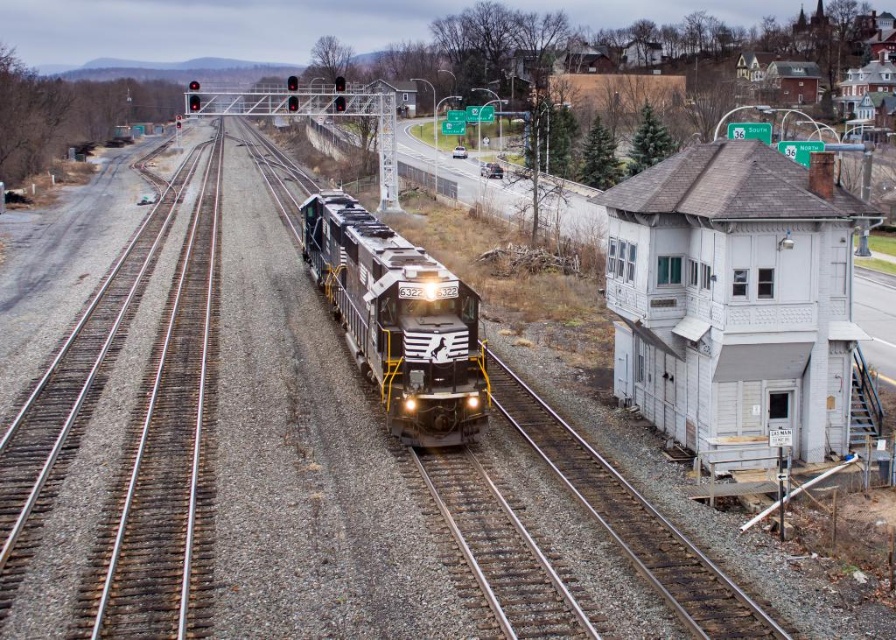
Question: Which point is farther to the camera?

Choices:
 (A) (506, 3)
 (B) (358, 285)

Answer: (A)

Question: Is black textured locomotive at center to the right of brick building at upper right from the viewer's perspective?

Choices:
 (A) yes
 (B) no

Answer: (B)

Question: Where is smooth steel tracks at center located in relation to brick building at upper right in the image?

Choices:
 (A) left
 (B) right

Answer: (A)

Question: Which object is the closest to the brick building at upper right?

Choices:
 (A) black textured locomotive at center
 (B) smooth steel tracks at center

Answer: (B)

Question: Which of the following is the farthest from the observer?

Choices:
 (A) brick building at upper right
 (B) smooth steel tracks at center
 (C) black textured locomotive at center

Answer: (A)

Question: Considering the relative positions of smooth steel tracks at center and brick building at upper right in the image provided, where is smooth steel tracks at center located with respect to brick building at upper right?

Choices:
 (A) above
 (B) below

Answer: (B)